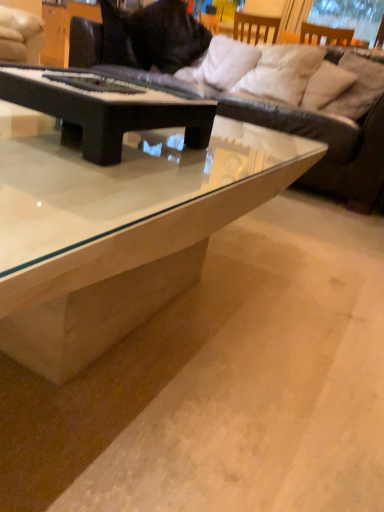
Question: From a real-world perspective, is white soft pillow at upper right, marked as the second pillow in a left-to-right arrangement, on top of white soft pillow at upper right, placed as the second pillow when sorted from right to left?

Choices:
 (A) no
 (B) yes

Answer: (B)

Question: Considering the relative positions of white soft pillow at upper right, marked as the second pillow in a left-to-right arrangement, and white soft pillow at upper right, arranged as the third pillow when viewed from the left, in the image provided, is white soft pillow at upper right, marked as the second pillow in a left-to-right arrangement, in front of white soft pillow at upper right, arranged as the third pillow when viewed from the left,?

Choices:
 (A) no
 (B) yes

Answer: (A)

Question: From the image's perspective, is white soft pillow at upper right, marked as the second pillow in a left-to-right arrangement, beneath white soft pillow at upper right, placed as the second pillow when sorted from right to left?

Choices:
 (A) no
 (B) yes

Answer: (A)

Question: Is white soft pillow at upper right, marked as the third pillow in a right-to-left arrangement, placed right next to white soft pillow at upper right, placed as the second pillow when sorted from right to left?

Choices:
 (A) yes
 (B) no

Answer: (B)

Question: Would you say white soft pillow at upper right, marked as the second pillow in a left-to-right arrangement, contains white soft pillow at upper right, placed as the second pillow when sorted from right to left?

Choices:
 (A) yes
 (B) no

Answer: (B)

Question: Does white soft pillow at upper right, marked as the third pillow in a right-to-left arrangement, have a greater width compared to white soft pillow at upper right, arranged as the third pillow when viewed from the left?

Choices:
 (A) no
 (B) yes

Answer: (B)

Question: Does white soft pillow at upper right, marked as the third pillow in a right-to-left arrangement, have a lesser height compared to black matte piano at center, which is the 1th coffee table from back to front?

Choices:
 (A) no
 (B) yes

Answer: (A)

Question: Does white soft pillow at upper right, marked as the third pillow in a right-to-left arrangement, turn towards black matte piano at center, which is the 1th coffee table from back to front?

Choices:
 (A) yes
 (B) no

Answer: (A)

Question: Are white soft pillow at upper right, marked as the second pillow in a left-to-right arrangement, and black matte piano at center, which is the 1th coffee table from back to front, far apart?

Choices:
 (A) yes
 (B) no

Answer: (A)

Question: Does white soft pillow at upper right, marked as the second pillow in a left-to-right arrangement, come behind black matte piano at center, which is the 1th coffee table from back to front?

Choices:
 (A) yes
 (B) no

Answer: (A)

Question: Does white soft pillow at upper right, marked as the third pillow in a right-to-left arrangement, have a greater height compared to black matte piano at center, which appears as the 2th coffee table when viewed from the front?

Choices:
 (A) yes
 (B) no

Answer: (A)

Question: From a real-world perspective, is white soft pillow at upper right, marked as the second pillow in a left-to-right arrangement, on top of black matte piano at center, which is the 1th coffee table from back to front?

Choices:
 (A) no
 (B) yes

Answer: (B)

Question: Can you confirm if black matte piano at center, which appears as the 2th coffee table when viewed from the front, is wider than beige fabric pillow at upper right, which appears as the 4th pillow when viewed from the left?

Choices:
 (A) no
 (B) yes

Answer: (B)